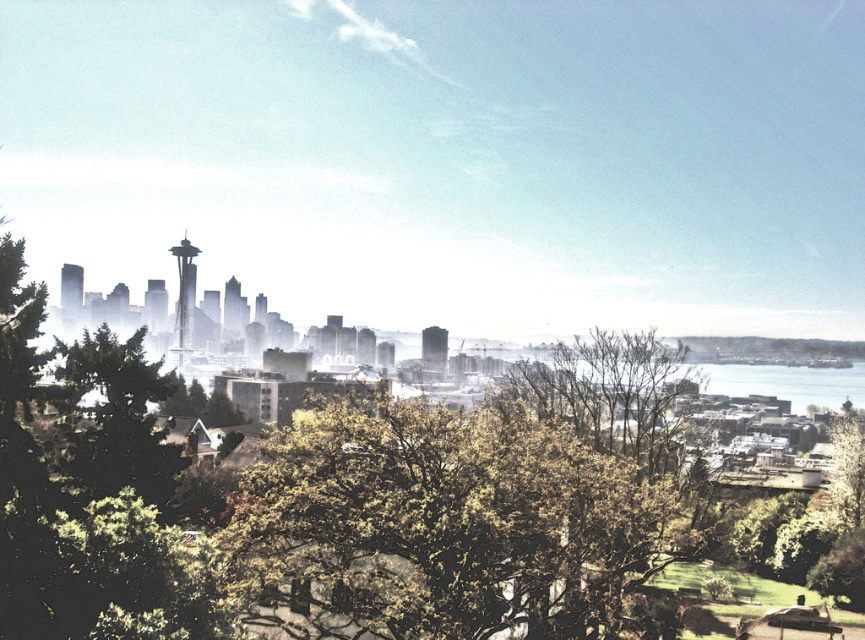
Question: Is green leafy tree at center above green textured tree at left?

Choices:
 (A) no
 (B) yes

Answer: (A)

Question: Which of the following is the farthest from the observer?

Choices:
 (A) green textured tree at left
 (B) green leafy tree at center

Answer: (A)

Question: Among these points, which one is nearest to the camera?

Choices:
 (A) (85, 484)
 (B) (631, 557)

Answer: (A)

Question: Does green leafy tree at center have a greater width compared to green textured tree at left?

Choices:
 (A) no
 (B) yes

Answer: (B)

Question: Can you confirm if green leafy tree at center is positioned below green textured tree at left?

Choices:
 (A) yes
 (B) no

Answer: (A)